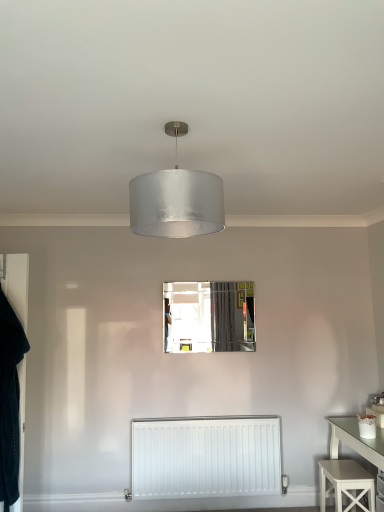
Question: In the image, is clear glass mirror at center positioned in front of or behind white painted wood stool at lower right?

Choices:
 (A) front
 (B) behind

Answer: (B)

Question: Considering the positions of point (185, 345) and point (329, 467), is point (185, 345) closer or farther from the camera than point (329, 467)?

Choices:
 (A) closer
 (B) farther

Answer: (B)

Question: Which is farther from the clear glass mirror at center?

Choices:
 (A) white painted wood stool at lower right
 (B) satin silver shade at center
 (C) white matte radiator at lower center
 (D) velvet black robe at left

Answer: (B)

Question: Based on their relative distances, which object is nearer to the velvet black robe at left?

Choices:
 (A) white matte radiator at lower center
 (B) white painted wood stool at lower right
 (C) satin silver shade at center
 (D) clear glass mirror at center

Answer: (A)